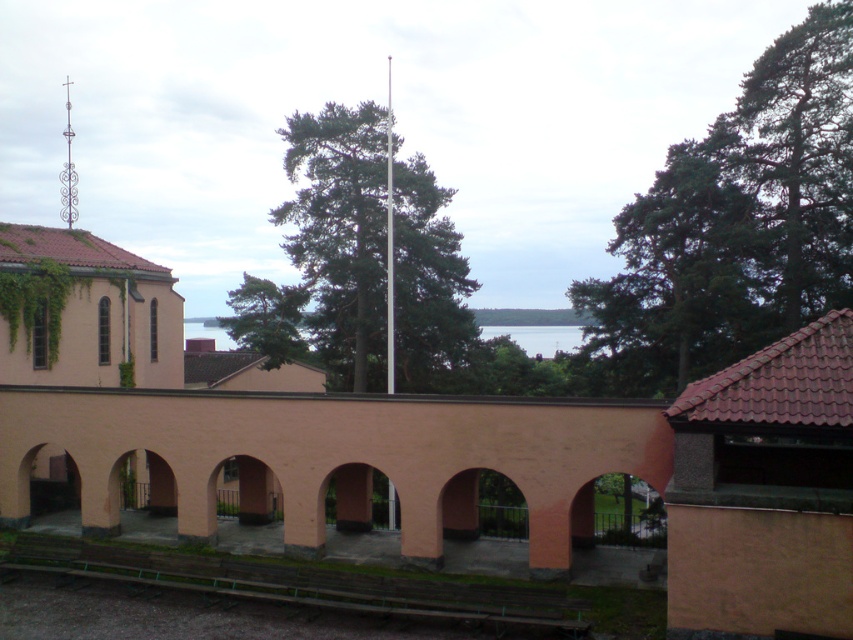
Question: Does green leafy tree at upper right have a larger size compared to silver metallic flag pole at center?

Choices:
 (A) no
 (B) yes

Answer: (A)

Question: Which of the following is the farthest from the observer?

Choices:
 (A) silver metallic flag pole at center
 (B) green needle-like leaves at upper right
 (C) green leafy tree at upper right

Answer: (B)

Question: Which point is farther from the camera taking this photo?

Choices:
 (A) (390, 394)
 (B) (659, 285)

Answer: (B)

Question: Which object is the closest to the green leafy tree at center?

Choices:
 (A) silver metallic flag pole at center
 (B) green needle-like leaves at upper right

Answer: (A)

Question: Is green leafy tree at upper right closer to camera compared to green needle-like leaves at upper right?

Choices:
 (A) no
 (B) yes

Answer: (B)

Question: Is green leafy tree at upper right thinner than silver metallic flag pole at center?

Choices:
 (A) yes
 (B) no

Answer: (B)